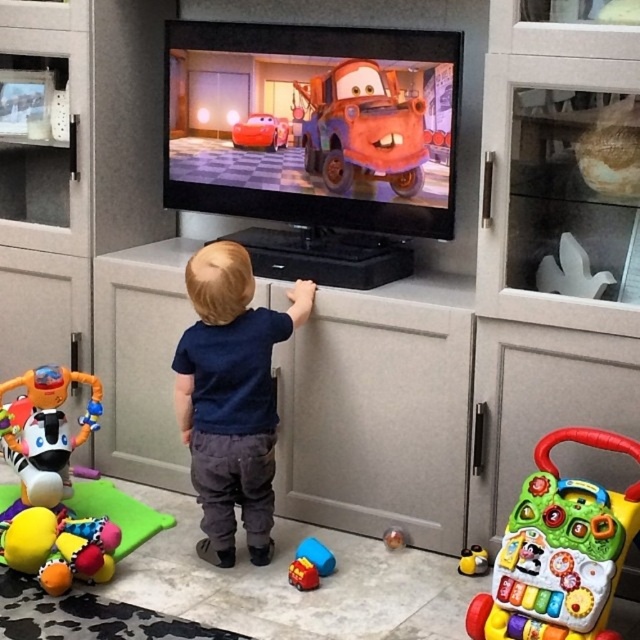
You are a parent trying to organize your child s toys. You see the matte blue truck at center and the shiny red toy car at center on the TV stand. According to their positions, which toy should you pick up first to avoid knocking over the other?

You should pick up the shiny red toy car at center first because the matte blue truck at center is located below it, so moving the upper toy first will prevent disturbing the lower one.

The child is holding a dark blue shirt at center and a rubberized plastic ball at center. Which item is positioned more to the left?

The dark blue shirt at center is positioned more to the left than the rubberized plastic ball at center.